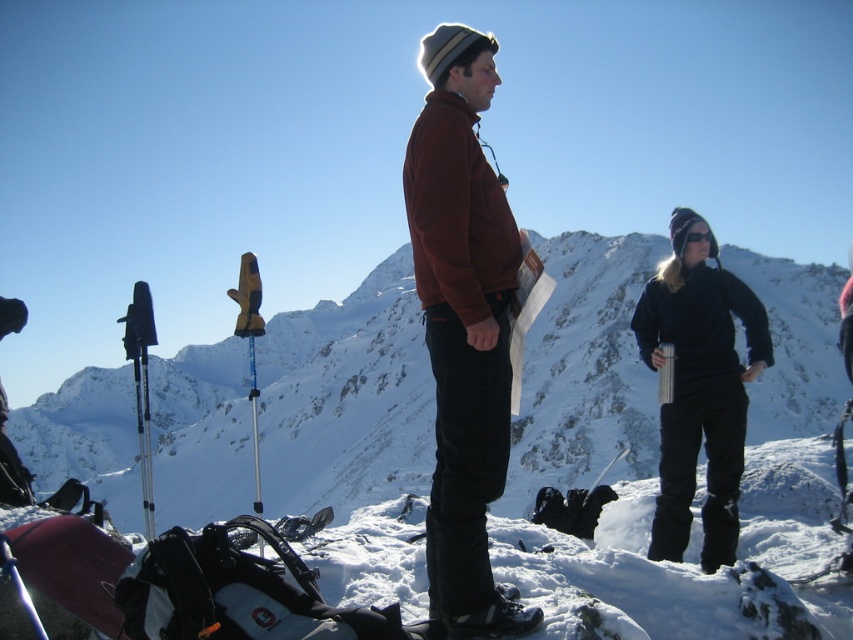
Question: Which point appears farthest from the camera in this image?

Choices:
 (A) (688, 317)
 (B) (476, 273)

Answer: (A)

Question: Is brown fleece jacket at center positioned at the back of black matte snow pants at right?

Choices:
 (A) yes
 (B) no

Answer: (B)

Question: Which point is closer to the camera?

Choices:
 (A) white snow at center
 (B) black matte snow pants at right

Answer: (B)

Question: Is white snow at center smaller than brown fleece jacket at center?

Choices:
 (A) yes
 (B) no

Answer: (B)

Question: Which of these objects is positioned farthest from the white snow at center?

Choices:
 (A) black matte snow pants at right
 (B) brown fleece jacket at center

Answer: (B)

Question: From the image, what is the correct spatial relationship of brown fleece jacket at center in relation to black matte snow pants at right?

Choices:
 (A) above
 (B) below

Answer: (B)